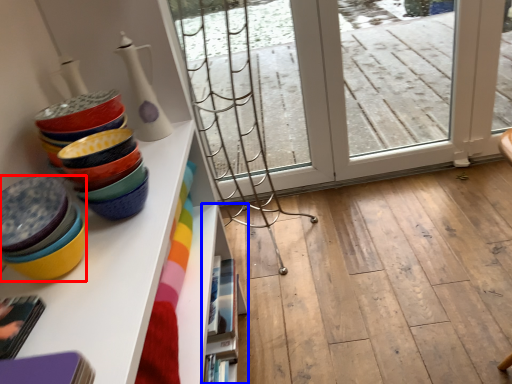
Question: Among these objects, which one is farthest to the camera, table (highlighted by a red box) or shelf (highlighted by a blue box)?

Choices:
 (A) table
 (B) shelf

Answer: (B)